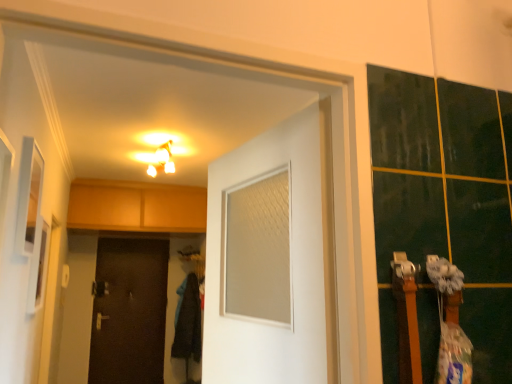
Question: Which direction should I rotate to look at white matte door at center, which appears as the 2th door when ordered from the bottom?

Choices:
 (A) right
 (B) left

Answer: (B)

Question: Does brown matte door at lower left, the 1th door positioned from the bottom, appear on the right side of white matte door at center, which appears as the 2th door when ordered from the bottom?

Choices:
 (A) yes
 (B) no

Answer: (B)

Question: From a real-world perspective, is brown matte door at lower left, the second door in the right-to-left sequence, beneath white matte door at center, which appears as the 2th door when ordered from the bottom?

Choices:
 (A) yes
 (B) no

Answer: (A)

Question: Considering the relative sizes of brown matte door at lower left, the second door viewed from the front, and white matte door at center, the first door from the right, in the image provided, is brown matte door at lower left, the second door viewed from the front, shorter than white matte door at center, the first door from the right,?

Choices:
 (A) no
 (B) yes

Answer: (A)

Question: Considering the relative sizes of brown matte door at lower left, the first door viewed from the back, and white matte door at center, which is the 1th door from top to bottom, in the image provided, is brown matte door at lower left, the first door viewed from the back, bigger than white matte door at center, which is the 1th door from top to bottom,?

Choices:
 (A) no
 (B) yes

Answer: (B)

Question: Can you confirm if brown matte door at lower left, the second door viewed from the front, is taller than white matte door at center, which is the 1th door from top to bottom?

Choices:
 (A) no
 (B) yes

Answer: (B)

Question: Can you confirm if brown matte door at lower left, the second door in the right-to-left sequence, is positioned to the left of white matte door at center, which is the 2th door in back-to-front order?

Choices:
 (A) no
 (B) yes

Answer: (B)

Question: Considering the relative positions of brown matte door at lower left, the first door viewed from the back, and matte white light fixture at upper center in the image provided, is brown matte door at lower left, the first door viewed from the back, to the right of matte white light fixture at upper center from the viewer's perspective?

Choices:
 (A) yes
 (B) no

Answer: (B)

Question: Is brown matte door at lower left, the 1th door positioned from the bottom, further to camera compared to matte white light fixture at upper center?

Choices:
 (A) no
 (B) yes

Answer: (B)

Question: Does brown matte door at lower left, the second door viewed from the top, appear on the left side of matte white light fixture at upper center?

Choices:
 (A) no
 (B) yes

Answer: (B)

Question: From the image's perspective, is brown matte door at lower left, the first door from the left, on matte white light fixture at upper center?

Choices:
 (A) no
 (B) yes

Answer: (A)

Question: Is the surface of brown matte door at lower left, the second door in the right-to-left sequence, in direct contact with matte white light fixture at upper center?

Choices:
 (A) yes
 (B) no

Answer: (B)

Question: From a real-world perspective, is brown matte door at lower left, the second door in the right-to-left sequence, physically below matte white light fixture at upper center?

Choices:
 (A) no
 (B) yes

Answer: (B)

Question: Is white matte door at center, the second door when ordered from left to right, located outside matte white light fixture at upper center?

Choices:
 (A) yes
 (B) no

Answer: (A)